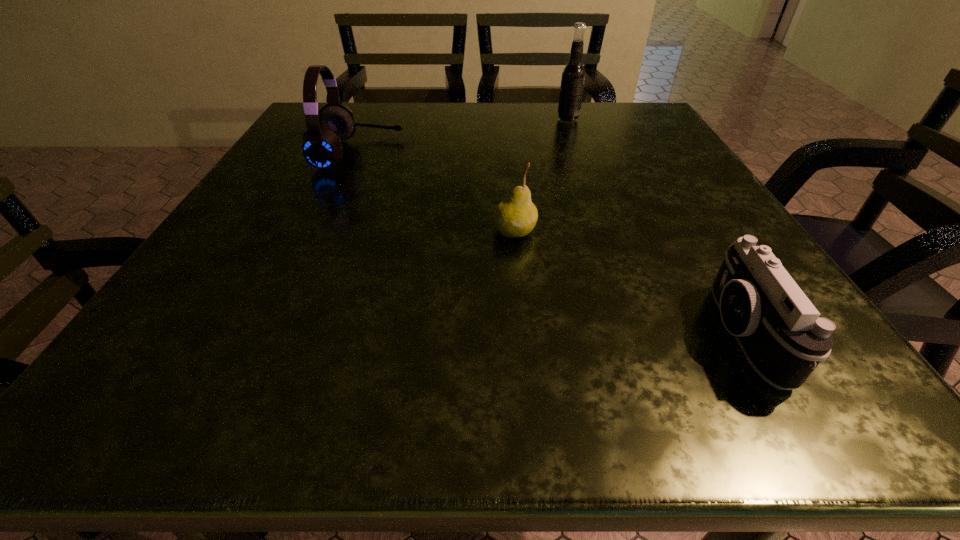
Locate an element on the screen. object at the right edge is located at coordinates (783, 336).

You are a GUI agent. You are given a task and a screenshot of the screen. Output one action in this format:
    pyautogui.click(x=<x>, y=<y>)
    Task: Click on the object situated at the far left corner
    The height and width of the screenshot is (540, 960).
    Given the screenshot: What is the action you would take?
    pyautogui.click(x=321, y=143)

You are a GUI agent. You are given a task and a screenshot of the screen. Output one action in this format:
    pyautogui.click(x=<x>, y=<y>)
    Task: Click on the object that is at the near right corner
    The image size is (960, 540).
    Given the screenshot: What is the action you would take?
    pyautogui.click(x=783, y=336)

Where is `vacant space at the far edge of the desktop`? vacant space at the far edge of the desktop is located at coordinates (442, 143).

This screenshot has width=960, height=540. What are the coordinates of `blank space at the near edge of the desktop` in the screenshot? It's located at tap(369, 383).

In the image, there is a desktop. Where is `vacant area at the left edge`? This screenshot has height=540, width=960. vacant area at the left edge is located at coordinates (230, 255).

Locate an element on the screen. vacant space at the right edge of the desktop is located at coordinates (640, 226).

In the image, there is a desktop. Identify the location of blank space at the far left corner. This screenshot has height=540, width=960. [363, 112].

Locate an element on the screen. The image size is (960, 540). free spot at the near left corner of the desktop is located at coordinates (125, 382).

Find the location of `vacant space at the far right corner of the desktop`. vacant space at the far right corner of the desktop is located at coordinates (600, 136).